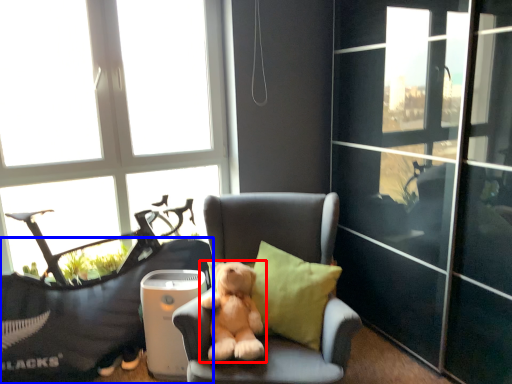
Question: Which object appears farthest to the camera in this image, dog (highlighted by a red box) or furniture (highlighted by a blue box)?

Choices:
 (A) dog
 (B) furniture

Answer: (B)